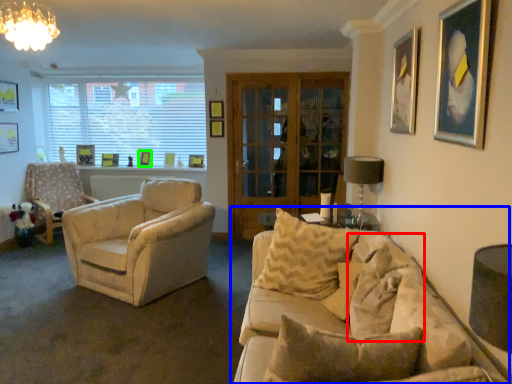
Question: Considering the real-world distances, which object is farthest from pillow (highlighted by a red box)? studio couch (highlighted by a blue box) or picture frame (highlighted by a green box)?

Choices:
 (A) studio couch
 (B) picture frame

Answer: (B)